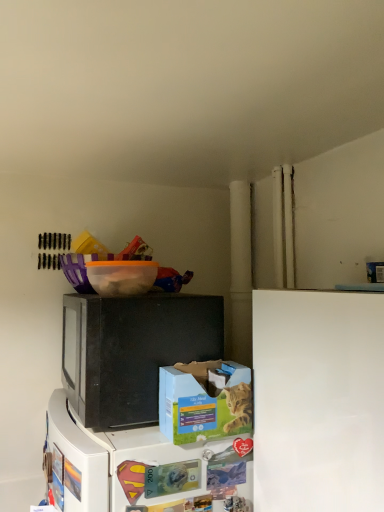
Question: From a real-world perspective, is black matte microwave at center physically located above or below orange translucent bowl at upper center?

Choices:
 (A) above
 (B) below

Answer: (B)

Question: Considering the positions of black matte microwave at center and orange translucent bowl at upper center in the image, is black matte microwave at center taller or shorter than orange translucent bowl at upper center?

Choices:
 (A) tall
 (B) short

Answer: (A)

Question: Which object is the farthest from the blue cardboard box at lower center?

Choices:
 (A) orange translucent bowl at upper center
 (B) white matte refrigerator at lower right
 (C) black matte microwave at center

Answer: (A)

Question: Which of these objects is positioned farthest from the orange translucent bowl at upper center?

Choices:
 (A) black matte microwave at center
 (B) blue cardboard box at lower center
 (C) white matte refrigerator at lower right

Answer: (C)